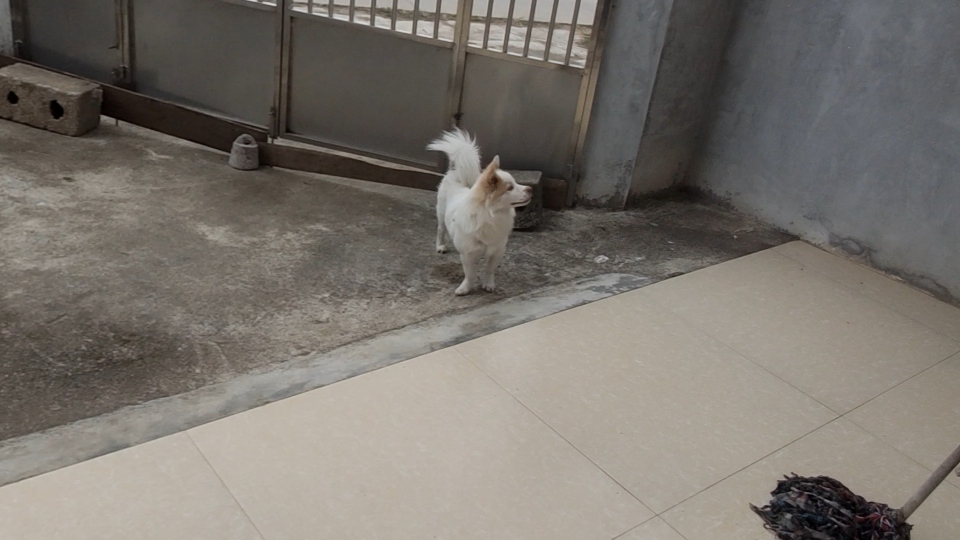
The width and height of the screenshot is (960, 540). Find the location of `new floor`. new floor is located at coordinates click(843, 262), click(565, 392), click(272, 468), click(722, 479), click(878, 408).